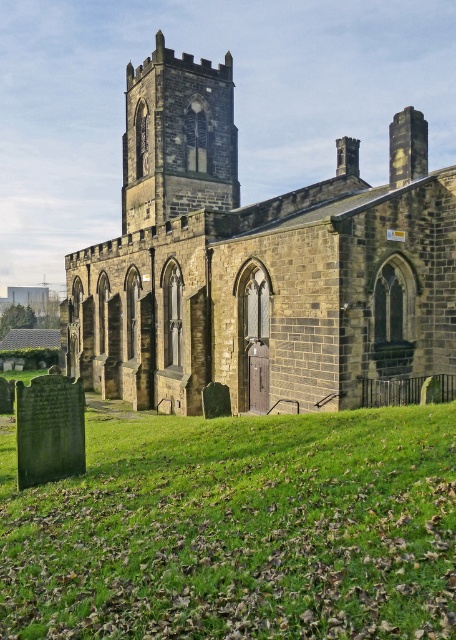
Question: Which object appears farthest from the camera in this image?

Choices:
 (A) brown stone church at center
 (B) dark gray stone tower at center

Answer: (B)

Question: Which object is closer to the camera taking this photo?

Choices:
 (A) brown stone church at center
 (B) green grass at lower center
 (C) dark gray stone tower at center

Answer: (B)

Question: Which object is the farthest from the brown stone church at center?

Choices:
 (A) dark gray stone tower at center
 (B) green grass at lower center

Answer: (B)

Question: Does brown stone church at center appear on the left side of dark gray stone tower at center?

Choices:
 (A) yes
 (B) no

Answer: (B)

Question: Is green grass at lower center positioned in front of dark gray stone tower at center?

Choices:
 (A) yes
 (B) no

Answer: (A)

Question: Can you confirm if green grass at lower center is positioned below dark gray stone tower at center?

Choices:
 (A) yes
 (B) no

Answer: (A)